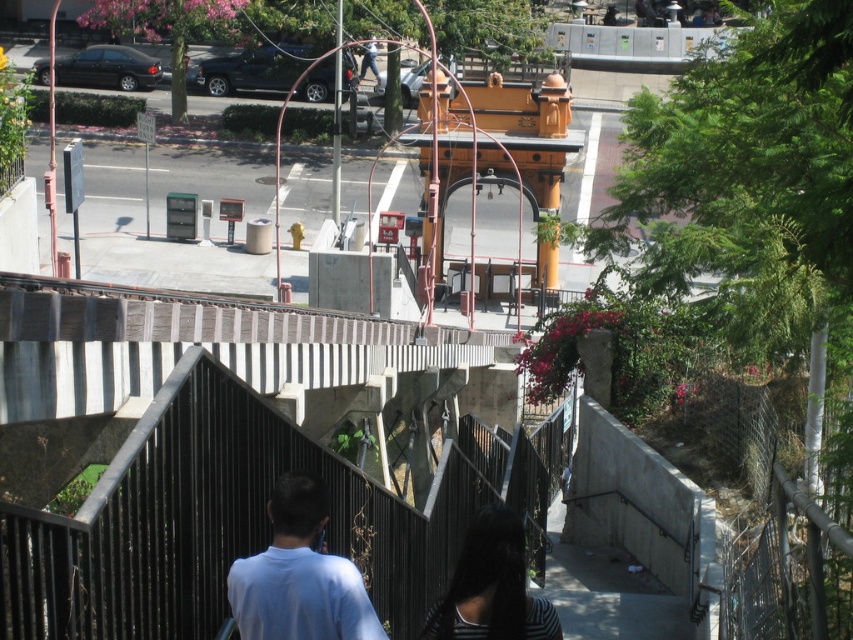
You are a drone operator tasked with capturing aerial footage of the scene. You need to ensure that both the light blue cotton shirt at center and the dark brown hair at center are in focus simultaneously. Given that your camera has a depth of field that can sharply focus objects within a 100 cm range, can you achieve this?

The light blue cotton shirt at center is 97.81 centimeters away from the dark brown hair at center. Since the distance between them is within the 100 cm depth of field range, both objects can be in focus simultaneously.